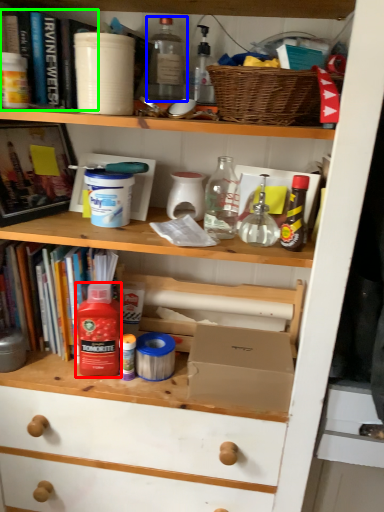
Question: Which object is positioned farthest from bottle (highlighted by a red box)? Select from bottle (highlighted by a blue box) and book (highlighted by a green box).

Choices:
 (A) bottle
 (B) book

Answer: (A)